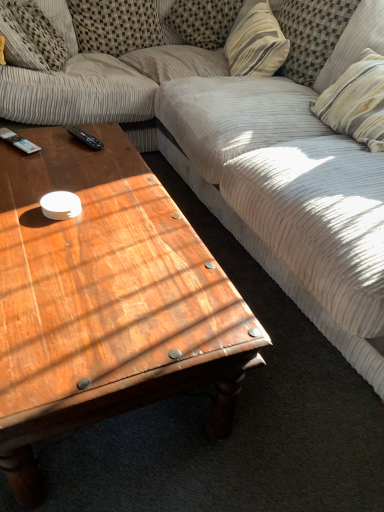
Locate an element on the screen. Image resolution: width=384 pixels, height=512 pixels. free space in front of black plastic remote control at upper left, acting as the 1th remote control starting from the left is located at coordinates (23, 168).